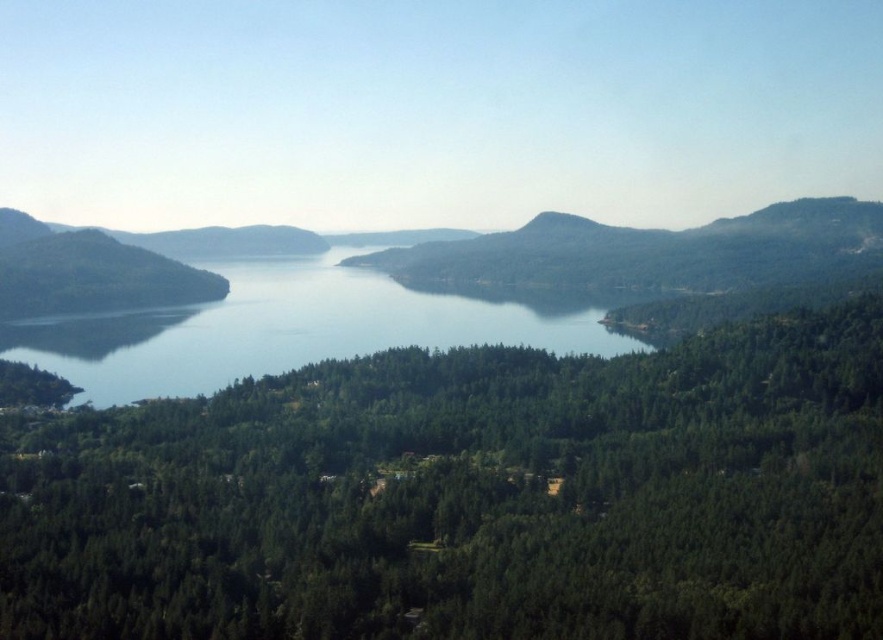
Does point (538, 420) lie in front of point (540, 301)?

Yes, it is.

Measure the distance between point (89,595) and camera.

Point (89,595) and camera are 145.17 meters apart from each other.

Find the location of a particular element. This screenshot has height=640, width=883. green matte forest at center is located at coordinates (466, 497).